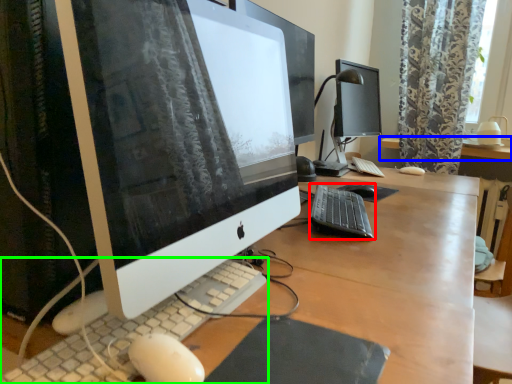
Question: Estimate the real-world distances between objects in this image. Which object is farther from computer keyboard (highlighted by a red box), desk (highlighted by a blue box) or computer keyboard (highlighted by a green box)?

Choices:
 (A) desk
 (B) computer keyboard

Answer: (A)